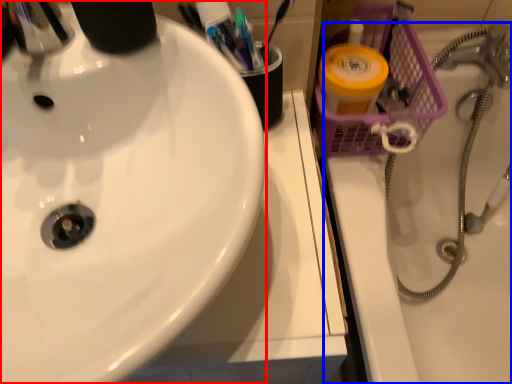
Question: Which of the following is the closest to the observer, sink (highlighted by a red box) or bath (highlighted by a blue box)?

Choices:
 (A) sink
 (B) bath

Answer: (A)